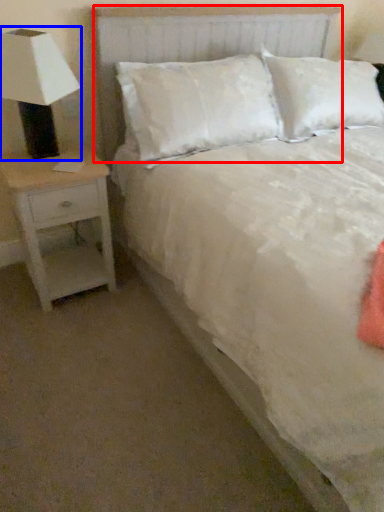
Question: Which object appears farthest to the camera in this image, headboard (highlighted by a red box) or lamp (highlighted by a blue box)?

Choices:
 (A) headboard
 (B) lamp

Answer: (A)